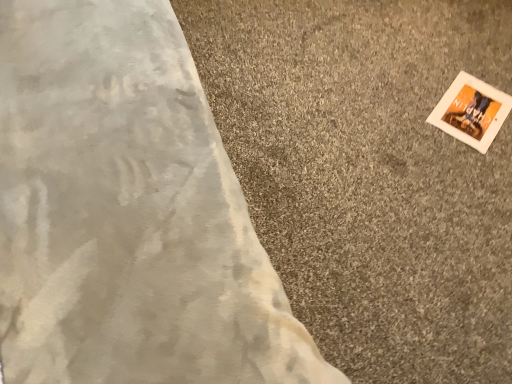
Question: Can you confirm if white matte picture frame at upper right is smaller than white soft carpet at upper right?

Choices:
 (A) no
 (B) yes

Answer: (B)

Question: Is the depth of white matte picture frame at upper right less than that of white soft carpet at upper right?

Choices:
 (A) no
 (B) yes

Answer: (A)

Question: Does white matte picture frame at upper right appear on the right side of white soft carpet at upper right?

Choices:
 (A) yes
 (B) no

Answer: (A)

Question: Is white matte picture frame at upper right turned away from white soft carpet at upper right?

Choices:
 (A) no
 (B) yes

Answer: (B)

Question: From a real-world perspective, is white matte picture frame at upper right positioned over white soft carpet at upper right based on gravity?

Choices:
 (A) no
 (B) yes

Answer: (B)

Question: From the image's perspective, is white matte picture frame at upper right located beneath white soft carpet at upper right?

Choices:
 (A) no
 (B) yes

Answer: (A)

Question: Is white matte picture frame at upper right a part of white soft carpet at upper right?

Choices:
 (A) yes
 (B) no

Answer: (A)

Question: From a real-world perspective, is white soft carpet at upper right on top of white matte picture frame at upper right?

Choices:
 (A) no
 (B) yes

Answer: (A)

Question: Is there a large distance between white soft carpet at upper right and white matte picture frame at upper right?

Choices:
 (A) yes
 (B) no

Answer: (B)

Question: Does white soft carpet at upper right have a greater width compared to white matte picture frame at upper right?

Choices:
 (A) no
 (B) yes

Answer: (B)

Question: Considering the relative sizes of white soft carpet at upper right and white matte picture frame at upper right in the image provided, is white soft carpet at upper right smaller than white matte picture frame at upper right?

Choices:
 (A) yes
 (B) no

Answer: (B)

Question: Is white soft carpet at upper right bigger than white matte picture frame at upper right?

Choices:
 (A) no
 (B) yes

Answer: (B)

Question: In the image, is white matte picture frame at upper right on the left side or the right side of white soft carpet at upper right?

Choices:
 (A) left
 (B) right

Answer: (B)